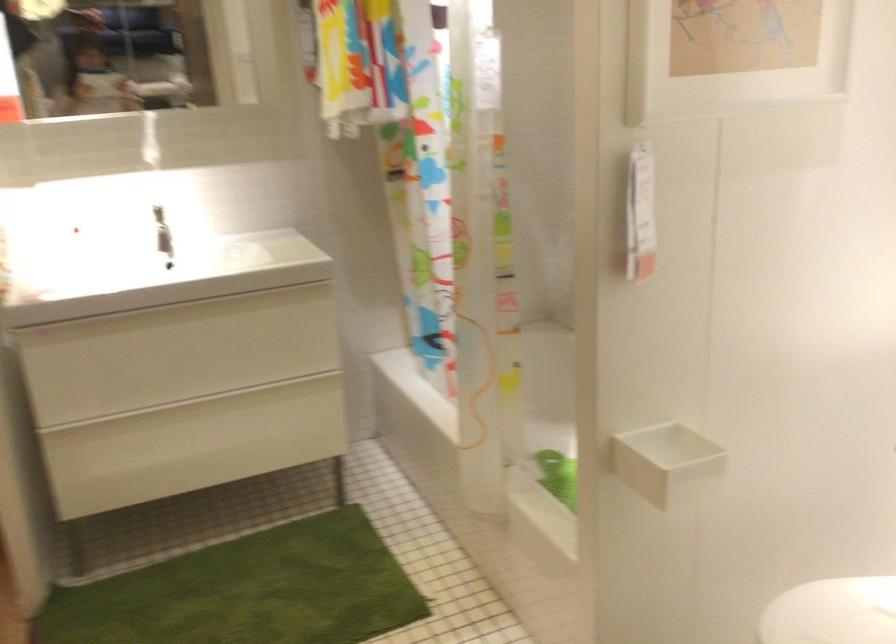
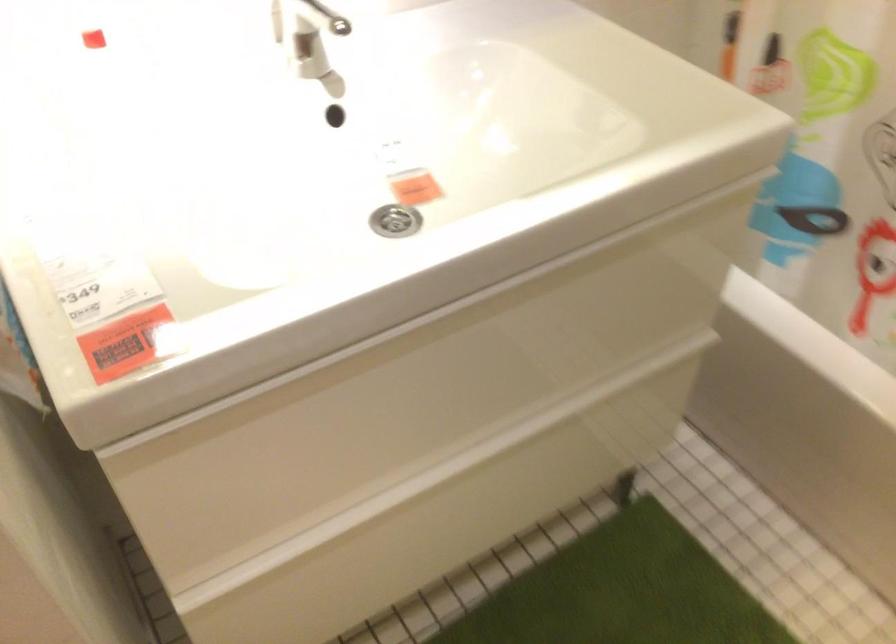
The point at (166, 351) is marked in the first image. Where is the corresponding point in the second image?

(423, 392)